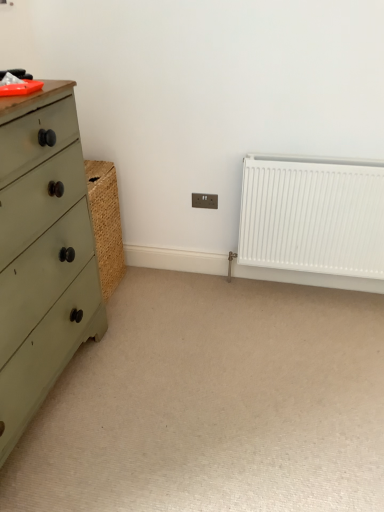
Question: Considering the positions of green matte chest of drawers at left and brown plastic electric outlet at center in the image, is green matte chest of drawers at left wider or thinner than brown plastic electric outlet at center?

Choices:
 (A) thin
 (B) wide

Answer: (B)

Question: In terms of size, does green matte chest of drawers at left appear bigger or smaller than brown plastic electric outlet at center?

Choices:
 (A) big
 (B) small

Answer: (A)

Question: Estimate the real-world distances between objects in this image. Which object is closer to the brown plastic electric outlet at center?

Choices:
 (A) green matte chest of drawers at left
 (B) beige carpet at center
 (C) white matte radiator at right

Answer: (C)

Question: Based on their relative distances, which object is nearer to the green matte chest of drawers at left?

Choices:
 (A) beige carpet at center
 (B) white matte radiator at right
 (C) brown plastic electric outlet at center

Answer: (A)